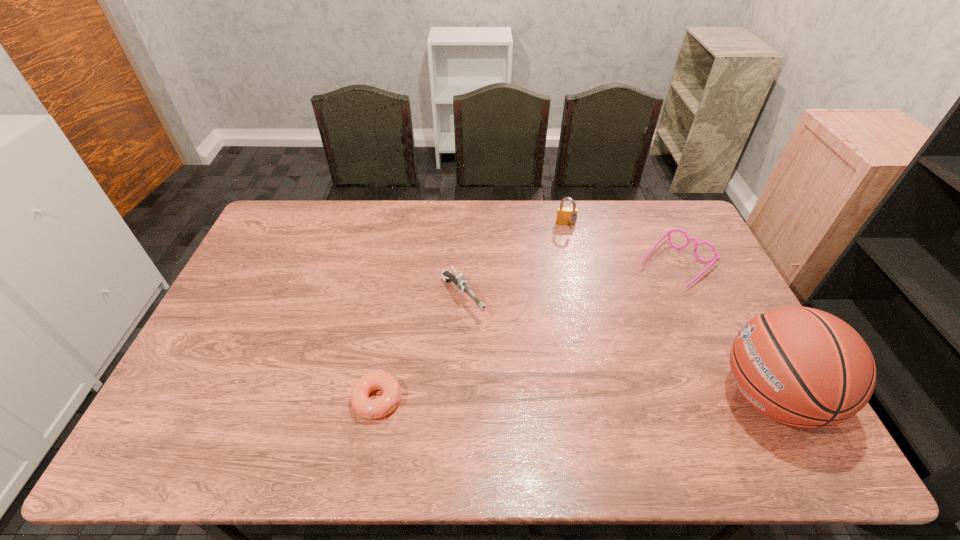
Where is `free spot on the desktop that is between the shortest object and the basketball and is positioned on the side with the combination dials of the padlock`? free spot on the desktop that is between the shortest object and the basketball and is positioned on the side with the combination dials of the padlock is located at coordinates (597, 398).

Find the location of `free space on the desktop that is between the shortest object and the basketball and is positioned aimed along the barrel of the third tallest object`. free space on the desktop that is between the shortest object and the basketball and is positioned aimed along the barrel of the third tallest object is located at coordinates point(549,398).

At what (x,y) coordinates should I click in order to perform the action: click on free space on the desktop that is between the doughnut and the basketball and is positioned on the arms of the fourth tallest object. Please return your answer as a coordinate pair (x, y). The width and height of the screenshot is (960, 540). Looking at the image, I should click on (538, 399).